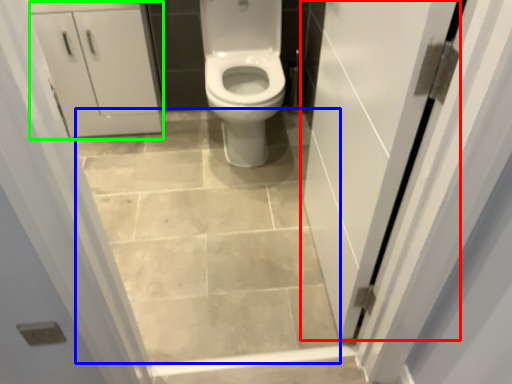
Question: Estimate the real-world distances between objects in this image. Which object is closer to door (highlighted by a red box), ceramic tile (highlighted by a blue box) or cabinetry (highlighted by a green box)?

Choices:
 (A) ceramic tile
 (B) cabinetry

Answer: (A)